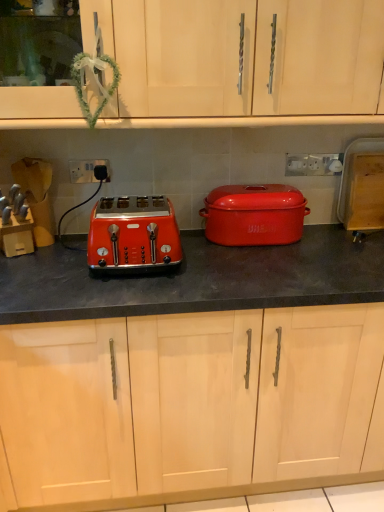
Locate an element on the screen. free space in front of matte red casserole at center is located at coordinates (276, 274).